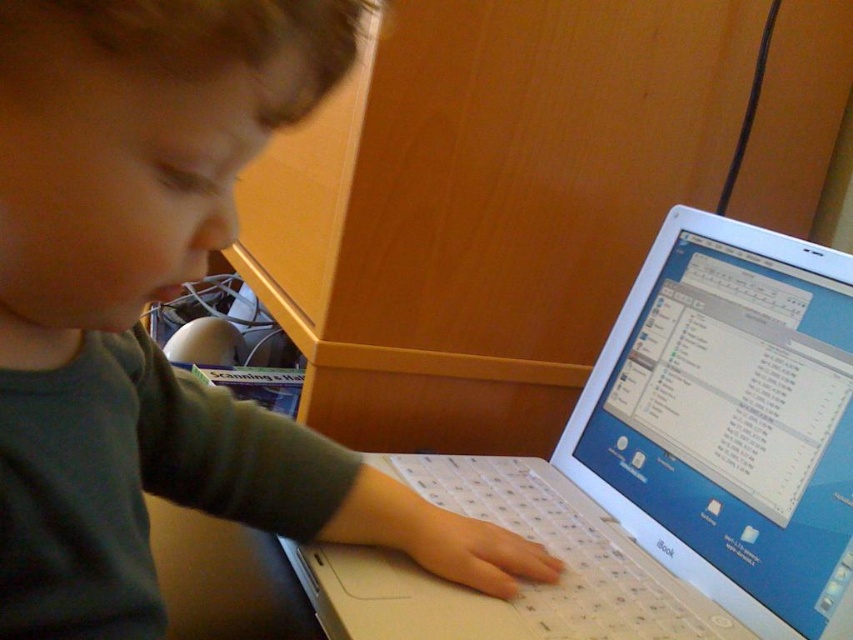
Is gray matte shirt at upper left positioned behind white plastic laptop at center?

No, it is in front of white plastic laptop at center.

Can you confirm if gray matte shirt at upper left is taller than white plastic laptop at center?

Incorrect, gray matte shirt at upper left's height is not larger of white plastic laptop at center's.

Who is more forward, (16, 584) or (747, 576)?

Point (16, 584) is more forward.

Locate an element on the screen. This screenshot has width=853, height=640. gray matte shirt at upper left is located at coordinates (155, 300).